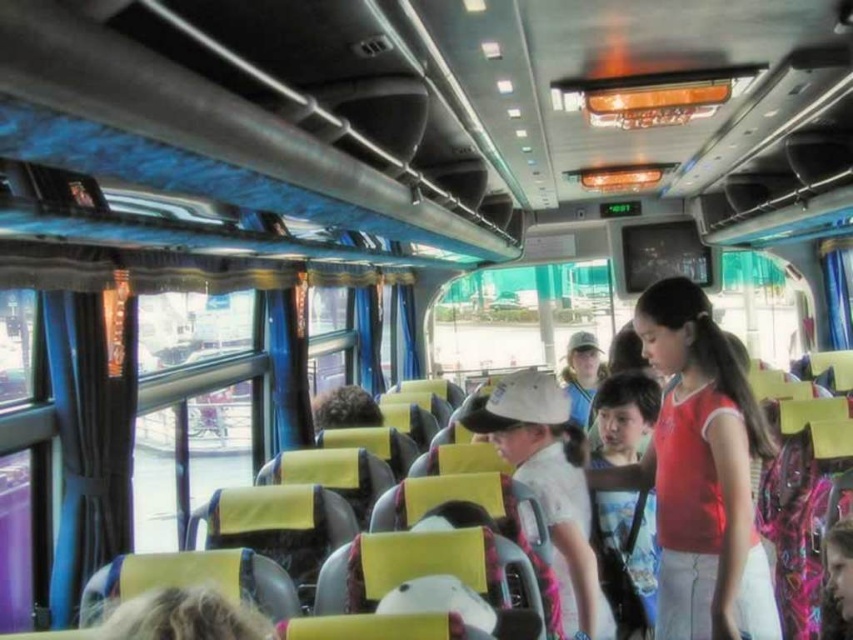
Question: Is white matte hat at center wider than matte white cap at center?

Choices:
 (A) no
 (B) yes

Answer: (A)

Question: From the image, what is the correct spatial relationship of white matte hat at center in relation to matte white cap at center?

Choices:
 (A) left
 (B) right

Answer: (A)

Question: Is white matte hat at center wider than matte white cap at center?

Choices:
 (A) no
 (B) yes

Answer: (A)

Question: Which of the following is the closest to the observer?

Choices:
 (A) white matte hat at center
 (B) matte white cap at center

Answer: (A)

Question: Which of the following is the closest to the observer?

Choices:
 (A) white matte hat at center
 (B) matte white cap at center

Answer: (A)